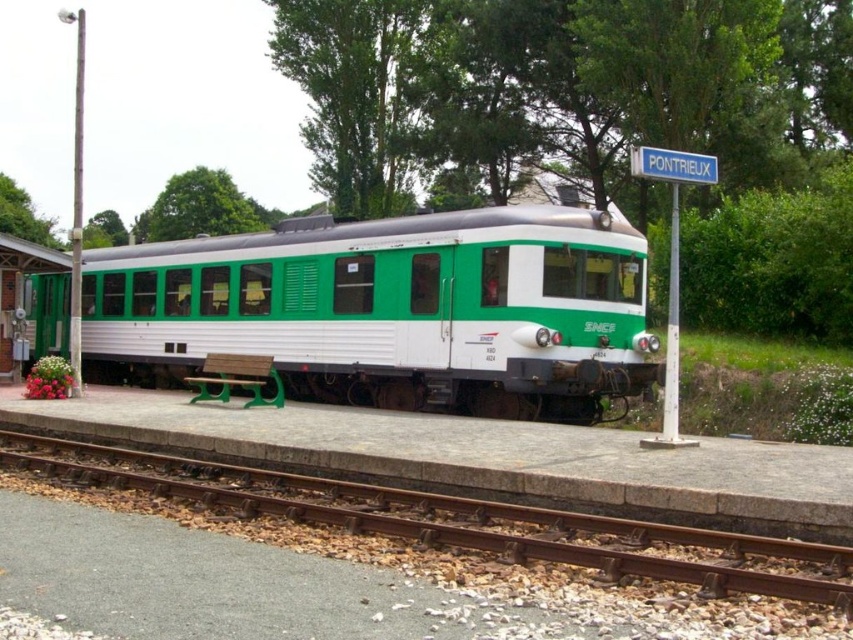
Is green matte train at center closer to the viewer compared to rusty metal track at lower left?

No, green matte train at center is further to the viewer.

Does point (607, 221) come in front of point (45, 451)?

No, it is behind (45, 451).

Where is `green matte train at center`? green matte train at center is located at coordinates (390, 308).

Locate an element on the screen. The width and height of the screenshot is (853, 640). green matte train at center is located at coordinates (390, 308).